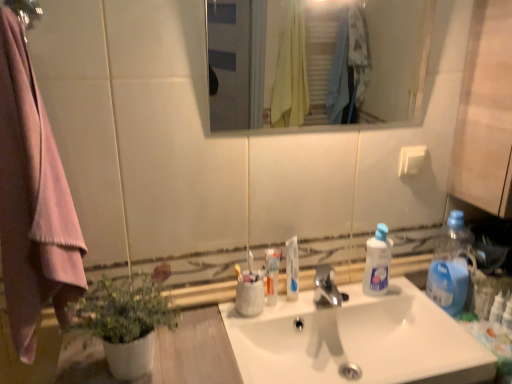
Question: Is green matte plant at lower left smaller than blue plastic bottle at right, the 1th bottle viewed from the right?

Choices:
 (A) no
 (B) yes

Answer: (A)

Question: From a real-world perspective, does green matte plant at lower left sit lower than blue plastic bottle at right, acting as the 2th bottle starting from the left?

Choices:
 (A) no
 (B) yes

Answer: (A)

Question: From a real-world perspective, is green matte plant at lower left positioned over blue plastic bottle at right, the 1th bottle viewed from the right, based on gravity?

Choices:
 (A) yes
 (B) no

Answer: (A)

Question: Is green matte plant at lower left shorter than blue plastic bottle at right, acting as the 2th bottle starting from the left?

Choices:
 (A) no
 (B) yes

Answer: (B)

Question: Does green matte plant at lower left turn towards blue plastic bottle at right, acting as the 2th bottle starting from the left?

Choices:
 (A) yes
 (B) no

Answer: (B)

Question: Can you confirm if green matte plant at lower left is bigger than blue plastic bottle at right, the 1th bottle viewed from the right?

Choices:
 (A) yes
 (B) no

Answer: (A)

Question: Is blue plastic bottle at right, acting as the 2th bottle starting from the left, with matte black shower at upper left?

Choices:
 (A) yes
 (B) no

Answer: (B)

Question: Does blue plastic bottle at right, acting as the 2th bottle starting from the left, appear on the right side of matte black shower at upper left?

Choices:
 (A) yes
 (B) no

Answer: (A)

Question: Is blue plastic bottle at right, acting as the 2th bottle starting from the left, smaller than matte black shower at upper left?

Choices:
 (A) yes
 (B) no

Answer: (B)

Question: Is blue plastic bottle at right, acting as the 2th bottle starting from the left, outside matte black shower at upper left?

Choices:
 (A) no
 (B) yes

Answer: (B)

Question: Considering the relative positions of blue plastic bottle at right, acting as the 2th bottle starting from the left, and matte black shower at upper left in the image provided, is blue plastic bottle at right, acting as the 2th bottle starting from the left, behind matte black shower at upper left?

Choices:
 (A) yes
 (B) no

Answer: (A)

Question: Is blue plastic bottle at right, acting as the 2th bottle starting from the left, facing away from matte black shower at upper left?

Choices:
 (A) no
 (B) yes

Answer: (A)

Question: From the image's perspective, would you say white glossy toothpaste at center, which ranks as the second toothpaste in right-to-left order, is shown under yellow plastic toothbrush at center, positioned as the 2th toothbrush in right-to-left order?

Choices:
 (A) no
 (B) yes

Answer: (B)